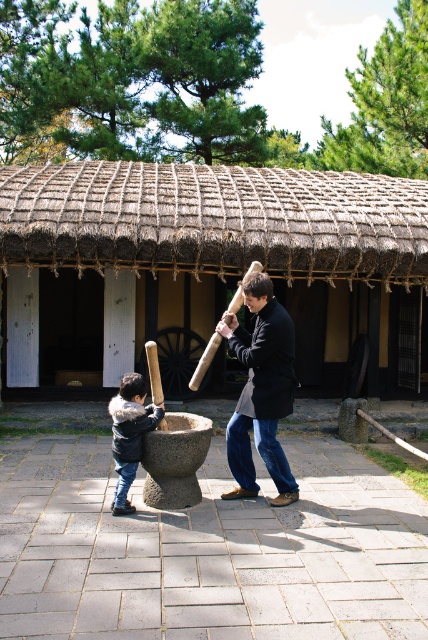
Which is behind, point (320, 225) or point (130, 376)?

The point (320, 225) is more distant.

I want to click on thatched straw hut at center, so click(x=205, y=262).

Is dark blue leather jacket at center positioned at the back of wooden baseball bat at lower center?

That is True.

Between point (119, 493) and point (160, 381), which one is positioned behind?

Positioned behind is point (160, 381).

At what (x,y) coordinates should I click in order to perform the action: click on dark blue leather jacket at center. Please return your answer as a coordinate pair (x, y). Looking at the image, I should click on (130, 433).

Between dark blue leather jacket at center and wooden baseball bat at center, which one appears on the right side from the viewer's perspective?

wooden baseball bat at center

What do you see at coordinates (130, 433) in the screenshot? Image resolution: width=428 pixels, height=640 pixels. I see `dark blue leather jacket at center` at bounding box center [130, 433].

Locate an element on the screen. The image size is (428, 640). dark blue leather jacket at center is located at coordinates (130, 433).